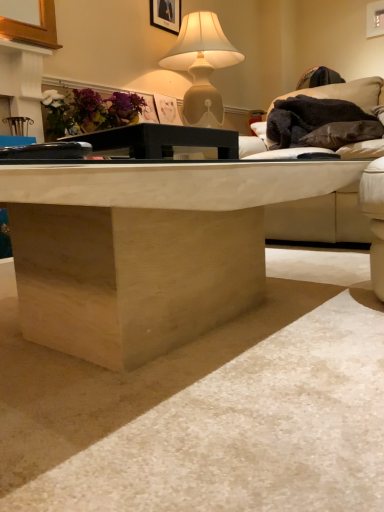
Question: Visually, is natural wood coffee table at center positioned to the left or to the right of black matte table at center?

Choices:
 (A) left
 (B) right

Answer: (B)

Question: Relative to black matte table at center, is natural wood coffee table at center in front or behind?

Choices:
 (A) front
 (B) behind

Answer: (A)

Question: Which object is the closest to the black matte table at center?

Choices:
 (A) natural wood coffee table at center
 (B) black fuzzy blanket at upper right
 (C) matte black picture frame at upper center
 (D) matte beige lamp at upper center
 (E) matte floral arrangement at upper left

Answer: (A)

Question: Based on their relative distances, which object is nearer to the natural wood coffee table at center?

Choices:
 (A) black matte table at center
 (B) black fuzzy blanket at upper right
 (C) matte beige lamp at upper center
 (D) matte black picture frame at upper center
 (E) matte floral arrangement at upper left

Answer: (A)